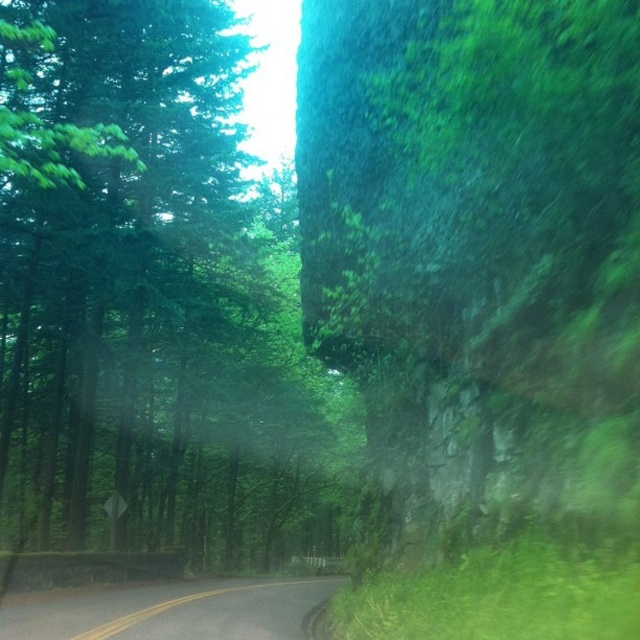
Does green leafy tree at center come behind black asphalt road at lower center?

Yes.

Based on the photo, who is shorter, green leafy tree at center or black asphalt road at lower center?

With less height is black asphalt road at lower center.

At what (x,y) coordinates should I click in order to perform the action: click on green leafy tree at center. Please return your answer as a coordinate pair (x, y). Image resolution: width=640 pixels, height=640 pixels. Looking at the image, I should click on (156, 304).